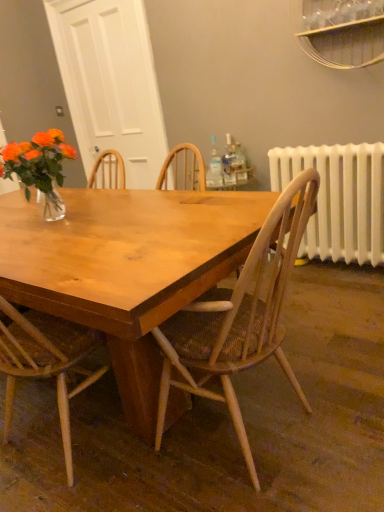
Question: Considering the relative sizes of clear glass bottle at center, which is the first bottle from left to right, and translucent plastic bottle at upper right, which ranks as the first bottle in right-to-left order, in the image provided, is clear glass bottle at center, which is the first bottle from left to right, taller than translucent plastic bottle at upper right, which ranks as the first bottle in right-to-left order,?

Choices:
 (A) yes
 (B) no

Answer: (A)

Question: Is clear glass bottle at center, which is the first bottle from left to right, aimed at translucent plastic bottle at upper right, which ranks as the first bottle in right-to-left order?

Choices:
 (A) yes
 (B) no

Answer: (B)

Question: Considering the relative sizes of clear glass bottle at center, the 3th bottle when ordered from right to left, and translucent plastic bottle at upper right, the 3th bottle positioned from the left, in the image provided, is clear glass bottle at center, the 3th bottle when ordered from right to left, shorter than translucent plastic bottle at upper right, the 3th bottle positioned from the left,?

Choices:
 (A) no
 (B) yes

Answer: (A)

Question: From the image's perspective, is clear glass bottle at center, which is the first bottle from left to right, below translucent plastic bottle at upper right, the 3th bottle positioned from the left?

Choices:
 (A) no
 (B) yes

Answer: (A)

Question: Is clear glass bottle at center, which is the first bottle from left to right, smaller than translucent plastic bottle at upper right, the 3th bottle positioned from the left?

Choices:
 (A) no
 (B) yes

Answer: (A)

Question: Considering the relative positions of clear glass bottle at upper center, the 2th bottle in the left-to-right sequence, and wooden chair at center in the image provided, is clear glass bottle at upper center, the 2th bottle in the left-to-right sequence, to the left or to the right of wooden chair at center?

Choices:
 (A) left
 (B) right

Answer: (B)

Question: Is clear glass bottle at upper center, marked as the second bottle in a right-to-left arrangement, in front of or behind wooden chair at center in the image?

Choices:
 (A) behind
 (B) front

Answer: (A)

Question: Which is correct: clear glass bottle at upper center, the 2th bottle in the left-to-right sequence, is inside wooden chair at center, or outside of it?

Choices:
 (A) outside
 (B) inside

Answer: (A)

Question: Considering the positions of clear glass bottle at upper center, the 2th bottle in the left-to-right sequence, and wooden chair at center in the image, is clear glass bottle at upper center, the 2th bottle in the left-to-right sequence, taller or shorter than wooden chair at center?

Choices:
 (A) short
 (B) tall

Answer: (A)

Question: From the image's perspective, is clear glass bottle at upper center, marked as the second bottle in a right-to-left arrangement, located above or below clear glass bottle at center, which is the first bottle from left to right?

Choices:
 (A) above
 (B) below

Answer: (A)

Question: Considering the relative positions of clear glass bottle at upper center, marked as the second bottle in a right-to-left arrangement, and clear glass bottle at center, which is the first bottle from left to right, in the image provided, is clear glass bottle at upper center, marked as the second bottle in a right-to-left arrangement, to the left or to the right of clear glass bottle at center, which is the first bottle from left to right,?

Choices:
 (A) right
 (B) left

Answer: (A)

Question: Is clear glass bottle at upper center, marked as the second bottle in a right-to-left arrangement, bigger or smaller than clear glass bottle at center, which is the first bottle from left to right?

Choices:
 (A) big
 (B) small

Answer: (B)

Question: Looking at their shapes, would you say clear glass bottle at upper center, marked as the second bottle in a right-to-left arrangement, is wider or thinner than clear glass bottle at center, which is the first bottle from left to right?

Choices:
 (A) wide
 (B) thin

Answer: (B)

Question: Is point (299, 212) closer or farther from the camera than point (225, 179)?

Choices:
 (A) closer
 (B) farther

Answer: (A)

Question: Is wooden chair at center taller or shorter than clear glass bottle at upper center, the 2th bottle in the left-to-right sequence?

Choices:
 (A) tall
 (B) short

Answer: (A)